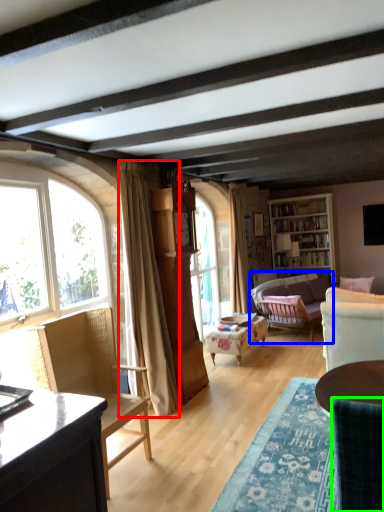
Question: Based on their relative distances, which object is farther from curtain (highlighted by a red box)? Choose from studio couch (highlighted by a blue box) and chair (highlighted by a green box).

Choices:
 (A) studio couch
 (B) chair

Answer: (A)